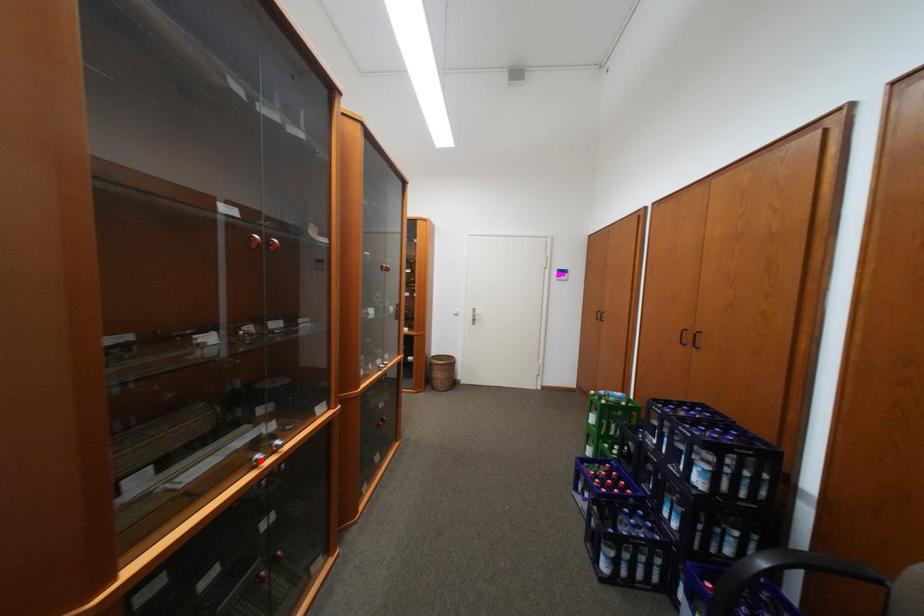
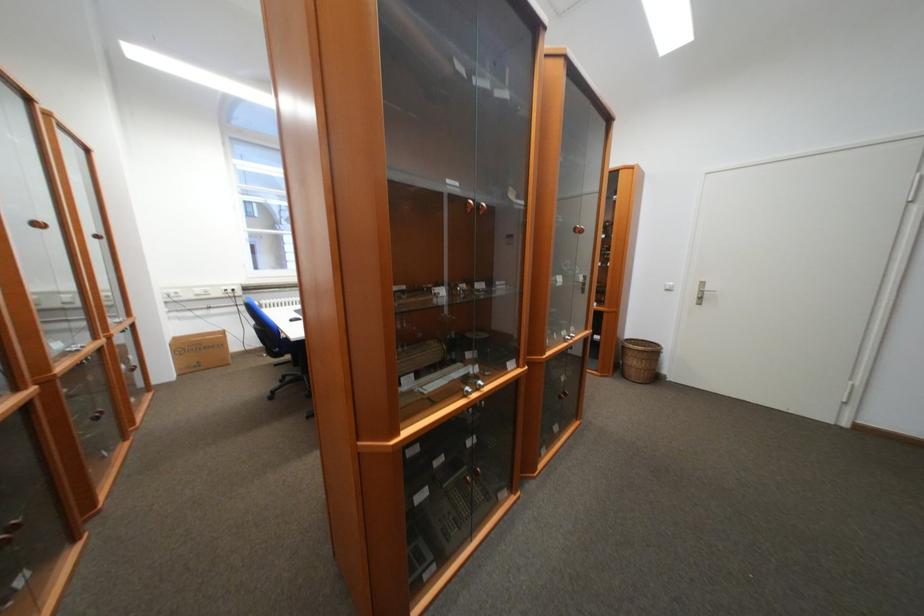
Find the pixel in the second image that matches the highlighted location in the first image.

(472, 390)